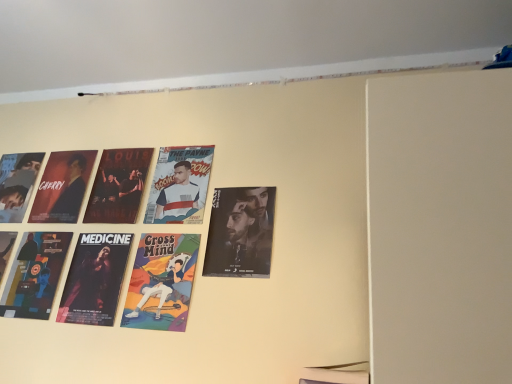
Question: Does cartoon character poster at center, the second person from the right, have a larger size compared to matte black poster at center, acting as the first poster starting from the right?

Choices:
 (A) yes
 (B) no

Answer: (B)

Question: From a real-world perspective, is cartoon character poster at center, the second person from the right, beneath matte black poster at center, the 3th poster from the left?

Choices:
 (A) no
 (B) yes

Answer: (B)

Question: Can you confirm if cartoon character poster at center, which appears as the 2th person when viewed from the left, is wider than matte black poster at center, the 3th poster from the left?

Choices:
 (A) no
 (B) yes

Answer: (A)

Question: Is matte black poster at center, the 3th poster from the left, completely or partially inside cartoon character poster at center, the second person from the right?

Choices:
 (A) yes
 (B) no

Answer: (B)

Question: Can you confirm if cartoon character poster at center, the second person from the right, is positioned to the right of matte black poster at center, the 3th poster from the left?

Choices:
 (A) yes
 (B) no

Answer: (B)

Question: From a real-world perspective, is cartoon character poster at center, the second person from the right, on top of matte black poster at center, acting as the first poster starting from the right?

Choices:
 (A) yes
 (B) no

Answer: (B)

Question: Does cartoon character poster at center, the second person from the right, have a lesser width compared to matte black poster at left, the third person positioned from the right?

Choices:
 (A) yes
 (B) no

Answer: (A)

Question: Can you confirm if cartoon character poster at center, the second person from the right, is shorter than matte black poster at left, the first person viewed from the left?

Choices:
 (A) yes
 (B) no

Answer: (B)

Question: From a real-world perspective, does cartoon character poster at center, the second person from the right, stand above matte black poster at left, the third person positioned from the right?

Choices:
 (A) no
 (B) yes

Answer: (A)

Question: Does cartoon character poster at center, which appears as the 2th person when viewed from the left, have a greater width compared to matte black poster at left, the first person viewed from the left?

Choices:
 (A) no
 (B) yes

Answer: (A)

Question: Can you confirm if cartoon character poster at center, the second person from the right, is positioned to the left of matte black poster at left, the first person viewed from the left?

Choices:
 (A) no
 (B) yes

Answer: (A)

Question: From a real-world perspective, is cartoon character poster at center, the second person from the right, beneath matte black poster at left, the third person positioned from the right?

Choices:
 (A) yes
 (B) no

Answer: (A)

Question: Is matte black poster at left, the first person viewed from the left, in front of cartoon character poster at center, which appears as the 2th person when viewed from the left?

Choices:
 (A) no
 (B) yes

Answer: (A)